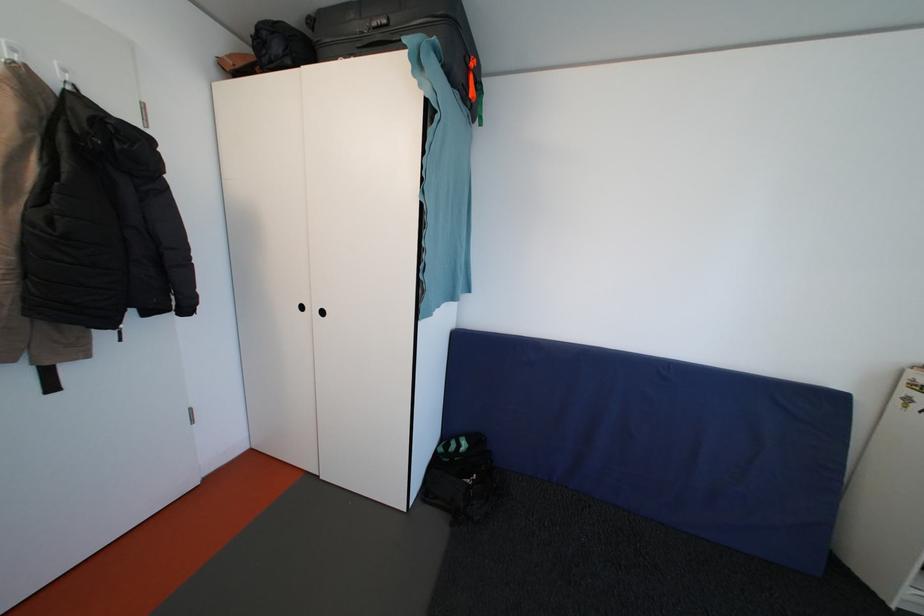
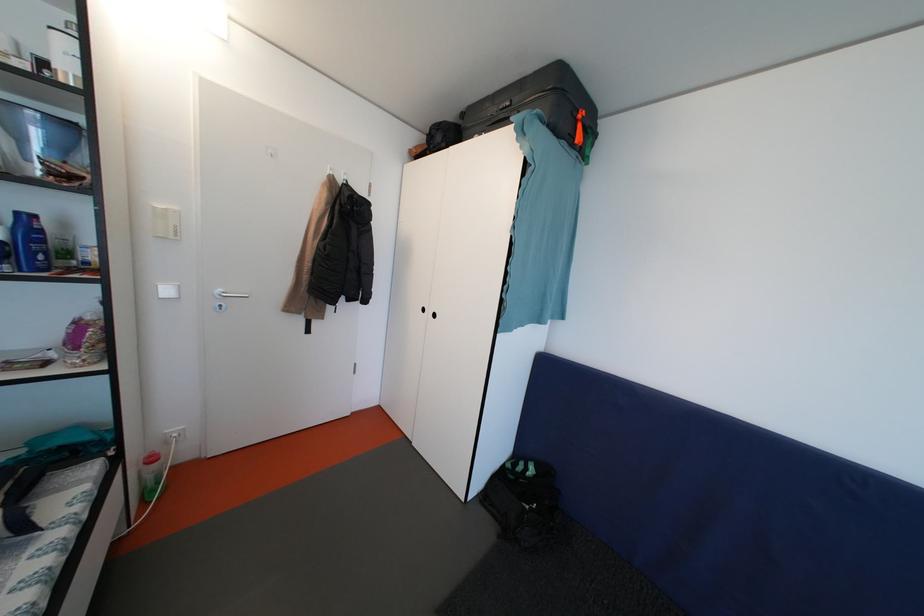
Find the pixel in the second image that matches [310,313] in the first image.

(431, 315)